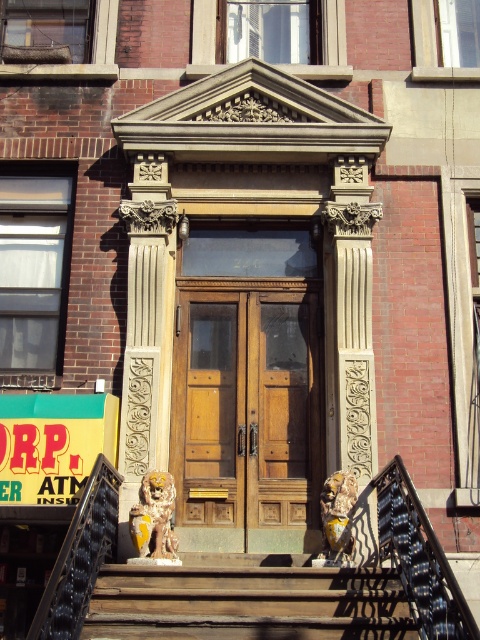
Question: Is wooden stairs at center thinner than yellow plastic atm sign at lower left?

Choices:
 (A) no
 (B) yes

Answer: (A)

Question: Is wooden door at center thinner than wooden stairs at center?

Choices:
 (A) no
 (B) yes

Answer: (B)

Question: Estimate the real-world distances between objects in this image. Which object is closer to the wooden stairs at center?

Choices:
 (A) wooden door at center
 (B) white carved stone column at center

Answer: (B)

Question: Can you confirm if wooden door at center is positioned to the left of yellow plastic atm sign at lower left?

Choices:
 (A) no
 (B) yes

Answer: (A)

Question: Estimate the real-world distances between objects in this image. Which object is closer to the wooden door at center?

Choices:
 (A) wooden stairs at center
 (B) yellow plastic atm sign at lower left

Answer: (B)

Question: Among these objects, which one is nearest to the camera?

Choices:
 (A) yellow plastic atm sign at lower left
 (B) wooden stairs at center
 (C) white carved stone column at center

Answer: (B)